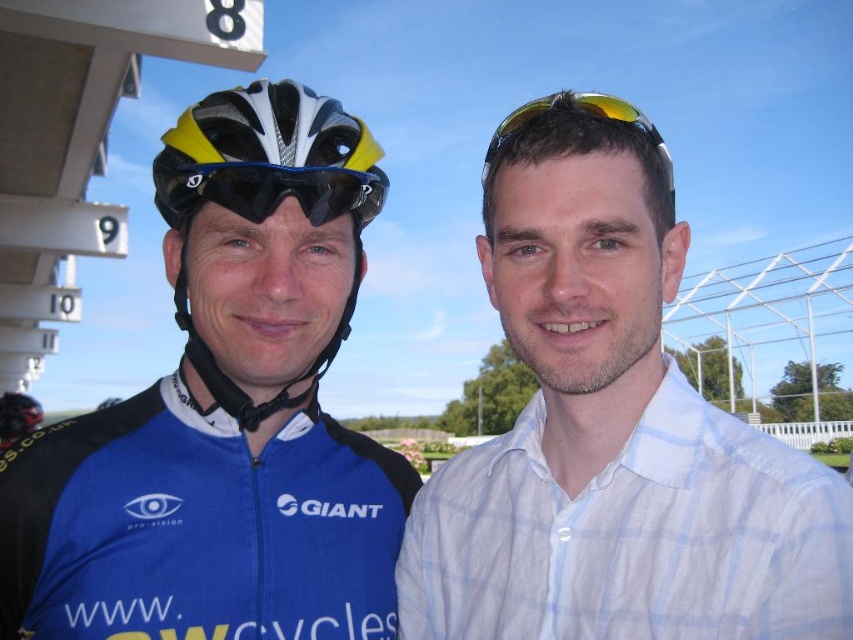
You are a photographer at a cycling event. You need to capture a photo of the matte black helmet at left and the yellow reflective lens sunglasses at upper center. Which object should you focus on first if you want to ensure both are in focus without moving the camera?

The matte black helmet at left is behind the yellow reflective lens sunglasses at upper center, so you should focus on the yellow reflective lens sunglasses at upper center first to ensure both are in focus without moving the camera.

You are a photographer at the event venue. You need to capture a photo where both the yellow reflective lens sunglasses at upper center and the matte black helmet at left are visible. Given their positions, which object would appear smaller in the photo?

The yellow reflective lens sunglasses at upper center would appear smaller in the photo because it is not as tall as the matte black helmet at left.